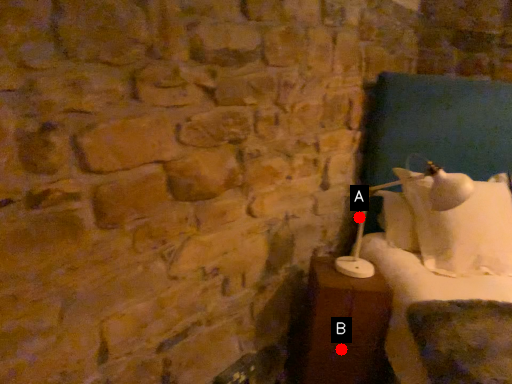
Question: Two points are circled on the image, labeled by A and B beside each circle. Which of the following is the closest to the observer?

Choices:
 (A) A is closer
 (B) B is closer

Answer: (B)